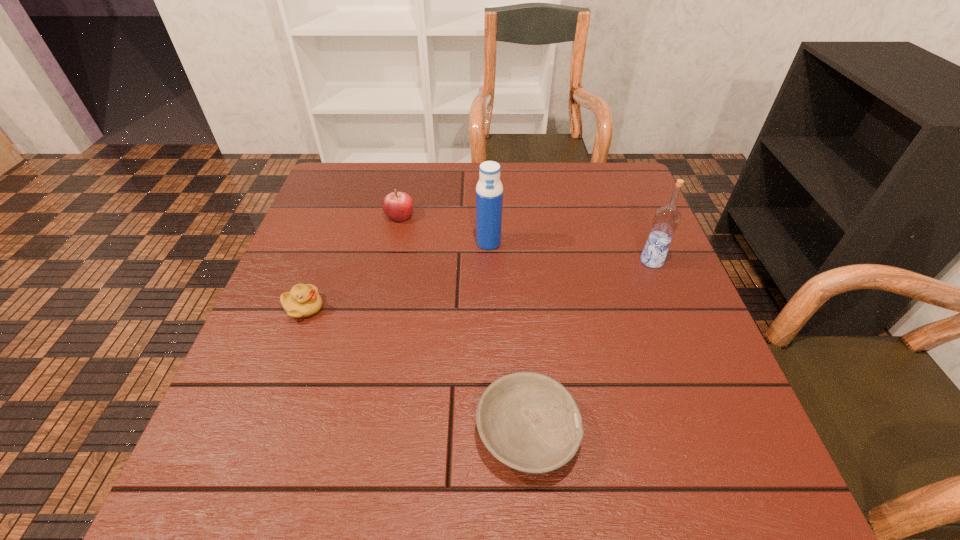
This screenshot has height=540, width=960. I want to click on free area in between the leftmost object and the nearest object, so click(416, 370).

Locate an element on the screen. empty location between the farthest object and the leftmost object is located at coordinates (351, 262).

Image resolution: width=960 pixels, height=540 pixels. In order to click on vacant area between the fourth nearest object and the farthest object in this screenshot , I will do `click(444, 229)`.

Identify the location of free area in between the third farthest object and the fourth nearest object. (570, 252).

In order to click on object that stands as the closest to the third farthest object in this screenshot , I will do `click(489, 191)`.

Where is `object that stands as the closest to the third nearest object`? object that stands as the closest to the third nearest object is located at coordinates (489, 191).

This screenshot has width=960, height=540. I want to click on free space that satisfies the following two spatial constraints: 1. on the front-facing side of the bowl; 2. on the right side of the leftmost object, so click(x=257, y=433).

Locate an element on the screen. The image size is (960, 540). vacant area in the image that satisfies the following two spatial constraints: 1. on the front side of the second farthest object; 2. on the left side of the shortest object is located at coordinates (492, 433).

This screenshot has height=540, width=960. What are the coordinates of `vacant space that satisfies the following two spatial constraints: 1. on the front side of the water bottle; 2. on the front-facing side of the second nearest object` in the screenshot? It's located at (490, 308).

Find the location of a particular element. The image size is (960, 540). vacant space that satisfies the following two spatial constraints: 1. on the front side of the second farthest object; 2. on the front-facing side of the second nearest object is located at coordinates (490, 308).